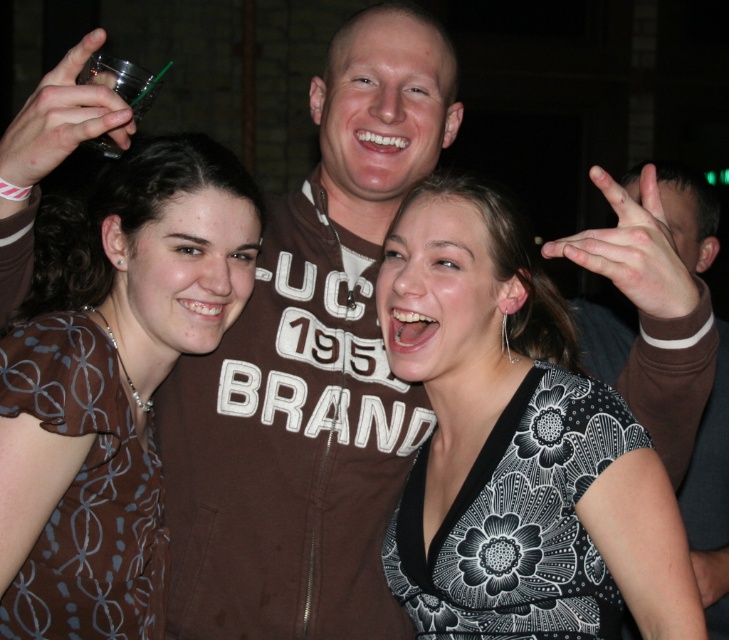
You are at a party and see the black floral dress at center and the clear plastic cup at upper left. Which item is located more to the right?

The black floral dress at center is positioned more to the right than the clear plastic cup at upper left.

You are a photographer at the event and need to capture a group photo. Since the black floral dress at center and brown printed dress at center are both in the frame, which dress should you focus on to ensure it takes up more space in the photo?

The black floral dress at center is larger in size than the brown printed dress at center, so focusing on it will ensure it takes up more space in the photo.